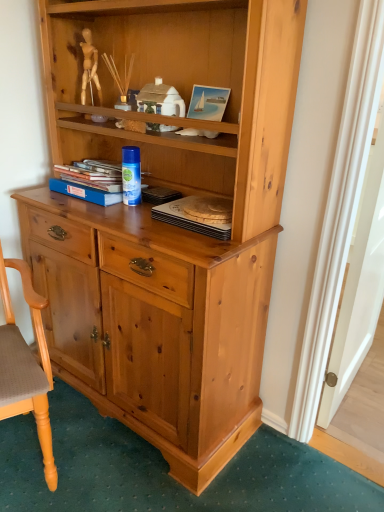
You are a GUI agent. You are given a task and a screenshot of the screen. Output one action in this format:
    pyautogui.click(x=<x>, y=<y>)
    Task: Click on the vacant area to the right of wooden polished chair at lower left
    The height and width of the screenshot is (512, 384).
    Given the screenshot: What is the action you would take?
    pyautogui.click(x=117, y=468)